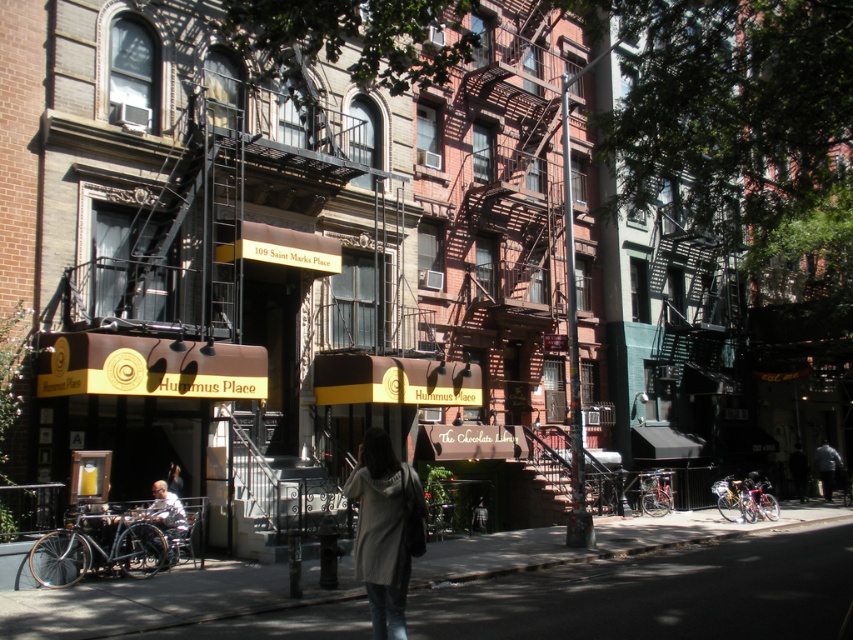
You are a delivery person standing on the smooth asphalt sidewalk at center. You need to hand a package to someone wearing the white fabric shirt at lower left. Can you reach them without moving from your current position?

The smooth asphalt sidewalk at center is located below the white fabric shirt at lower left, meaning the person is elevated relative to you. You may need to move closer or they might need to come down to receive the package.

You are a customer entering the store and see the knit sweater at center and the dark gray fabric jacket at lower right hanging on the rack. Which clothing item requires a smaller space to hang?

The knit sweater at center requires a smaller space to hang because it has a smaller size compared to the dark gray fabric jacket at lower right.